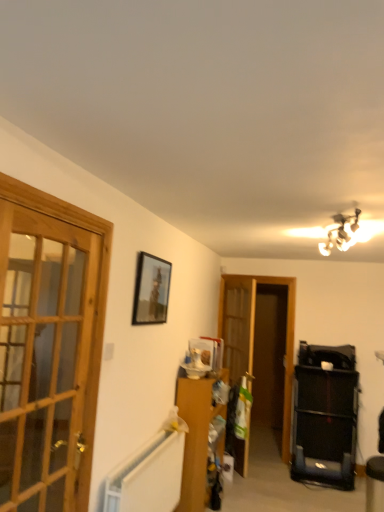
Where is `metallic chandelier at upper right`? metallic chandelier at upper right is located at coordinates [341, 233].

Find the location of a particular element. The height and width of the screenshot is (512, 384). translucent wood screen door at center is located at coordinates (237, 323).

Find the location of a particular element. This screenshot has height=512, width=384. matte black picture frame at upper center is located at coordinates (151, 290).

The height and width of the screenshot is (512, 384). What do you see at coordinates (43, 355) in the screenshot?
I see `wooden glass door at left` at bounding box center [43, 355].

The width and height of the screenshot is (384, 512). In order to click on metallic chandelier at upper right in this screenshot , I will do `click(341, 233)`.

From the image's perspective, is wooden cabinet at center over translucent wood screen door at center?

Incorrect, from the image's perspective, wooden cabinet at center is lower than translucent wood screen door at center.

Based on the photo, who is shorter, wooden cabinet at center or translucent wood screen door at center?

With less height is wooden cabinet at center.

Is wooden cabinet at center directly adjacent to translucent wood screen door at center?

wooden cabinet at center and translucent wood screen door at center are clearly separated.

This screenshot has width=384, height=512. I want to click on furniture on the left of translucent wood screen door at center, so click(x=195, y=438).

Who is bigger, wooden glass door at left or wooden cabinet at center?

wooden cabinet at center.

Where is `furniture below the wooden glass door at left (from the image's perspective)`? Image resolution: width=384 pixels, height=512 pixels. furniture below the wooden glass door at left (from the image's perspective) is located at coordinates (195, 438).

From the image's perspective, is wooden glass door at left beneath wooden cabinet at center?

No, from the image's perspective, wooden glass door at left is not beneath wooden cabinet at center.

What's the angular difference between metallic chandelier at upper right and wooden glass door at left's facing directions?

metallic chandelier at upper right and wooden glass door at left are facing 79.8 degrees away from each other.

Is metallic chandelier at upper right to the left of wooden glass door at left from the viewer's perspective?

No.

Are metallic chandelier at upper right and wooden glass door at left located far from each other?

Absolutely, metallic chandelier at upper right is distant from wooden glass door at left.

Find the location of `light fixture that is on the right side of wooden glass door at left`. light fixture that is on the right side of wooden glass door at left is located at coordinates (341, 233).

Considering the sizes of objects wooden glass door at left and metallic chandelier at upper right in the image provided, who is wider, wooden glass door at left or metallic chandelier at upper right?

metallic chandelier at upper right.

Is metallic chandelier at upper right a part of wooden glass door at left?

Actually, metallic chandelier at upper right is outside wooden glass door at left.

How different are the orientations of wooden glass door at left and metallic chandelier at upper right in degrees?

79.8 degrees separate the facing orientations of wooden glass door at left and metallic chandelier at upper right.

Looking at this image, could you tell me if wooden glass door at left is turned towards metallic chandelier at upper right?

No, wooden glass door at left is not oriented towards metallic chandelier at upper right.

From the image's perspective, is wooden glass door at left located beneath translucent wood screen door at center?

Actually, wooden glass door at left appears above translucent wood screen door at center in the image.

Does wooden glass door at left lie behind translucent wood screen door at center?

No.

Is wooden glass door at left situated inside translucent wood screen door at center or outside?

wooden glass door at left cannot be found inside translucent wood screen door at center.

From a real-world perspective, is wooden glass door at left positioned above or below translucent wood screen door at center?

From a real-world perspective, wooden glass door at left is physically above translucent wood screen door at center.

Find the location of a particular element. door above the translucent wood screen door at center (from the image's perspective) is located at coordinates (43, 355).

In the scene shown: Choose the correct answer: Is translucent wood screen door at center inside wooden glass door at left or outside it?

translucent wood screen door at center is outside wooden glass door at left.

Based on the photo, between translucent wood screen door at center and wooden glass door at left, which one has larger width?

translucent wood screen door at center is wider.

Measure the distance from translucent wood screen door at center to wooden glass door at left.

2.04 meters.

Based on their positions, is matte black picture frame at upper center located to the left or right of wooden cabinet at center?

Based on their positions, matte black picture frame at upper center is located to the left of wooden cabinet at center.

From a real-world perspective, which object rests below the other?

wooden cabinet at center.

Would you say matte black picture frame at upper center contains wooden cabinet at center?

No, wooden cabinet at center is not inside matte black picture frame at upper center.

How far apart are matte black picture frame at upper center and wooden cabinet at center?

1.06 meters.

I want to click on furniture located underneath the translucent wood screen door at center (from a real-world perspective), so click(195, 438).

The image size is (384, 512). Find the location of `furniture that is on the right side of wooden glass door at left`. furniture that is on the right side of wooden glass door at left is located at coordinates (195, 438).

Considering their positions, is translucent wood screen door at center positioned further to metallic chandelier at upper right than wooden glass door at left?

wooden glass door at left.

Looking at the image, which one is located closer to wooden glass door at left, metallic chandelier at upper right or wooden cabinet at center?

The object closer to wooden glass door at left is wooden cabinet at center.

Looking at the image, which one is located further to metallic chandelier at upper right, translucent wood screen door at center or matte black picture frame at upper center?

translucent wood screen door at center is positioned further to the anchor metallic chandelier at upper right.

Looking at the image, which one is located further to matte black picture frame at upper center, wooden glass door at left or translucent wood screen door at center?

translucent wood screen door at center lies further to matte black picture frame at upper center than the other object.

From the image, which object appears to be farther from wooden glass door at left, metallic chandelier at upper right or translucent wood screen door at center?

Among the two, metallic chandelier at upper right is located further to wooden glass door at left.

Estimate the real-world distances between objects in this image. Which object is further from matte black picture frame at upper center, translucent wood screen door at center or wooden cabinet at center?

translucent wood screen door at center is further to matte black picture frame at upper center.

When comparing their distances from wooden cabinet at center, does matte black picture frame at upper center or metallic chandelier at upper right seem further?

metallic chandelier at upper right.

Estimate the real-world distances between objects in this image. Which object is further from translucent wood screen door at center, wooden cabinet at center or wooden glass door at left?

wooden glass door at left is positioned further to the anchor translucent wood screen door at center.

The height and width of the screenshot is (512, 384). Identify the location of furniture positioned between metallic chandelier at upper right and translucent wood screen door at center from near to far. (195, 438).

Where is `light fixture positioned between wooden glass door at left and wooden cabinet at center from near to far`? light fixture positioned between wooden glass door at left and wooden cabinet at center from near to far is located at coordinates tap(341, 233).

You are a GUI agent. You are given a task and a screenshot of the screen. Output one action in this format:
    pyautogui.click(x=<x>, y=<y>)
    Task: Click on the picture frame between metallic chandelier at upper right and wooden cabinet at center in the vertical direction
    The width and height of the screenshot is (384, 512).
    Given the screenshot: What is the action you would take?
    pyautogui.click(x=151, y=290)

Find the location of a particular element. This screenshot has height=512, width=384. picture frame between metallic chandelier at upper right and translucent wood screen door at center from front to back is located at coordinates (151, 290).